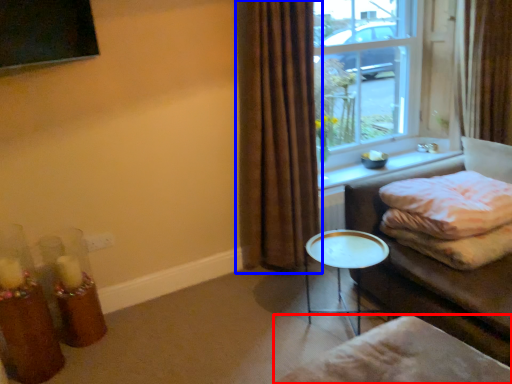
Question: Among these objects, which one is nearest to the camera, footrest (highlighted by a red box) or curtain (highlighted by a blue box)?

Choices:
 (A) footrest
 (B) curtain

Answer: (A)